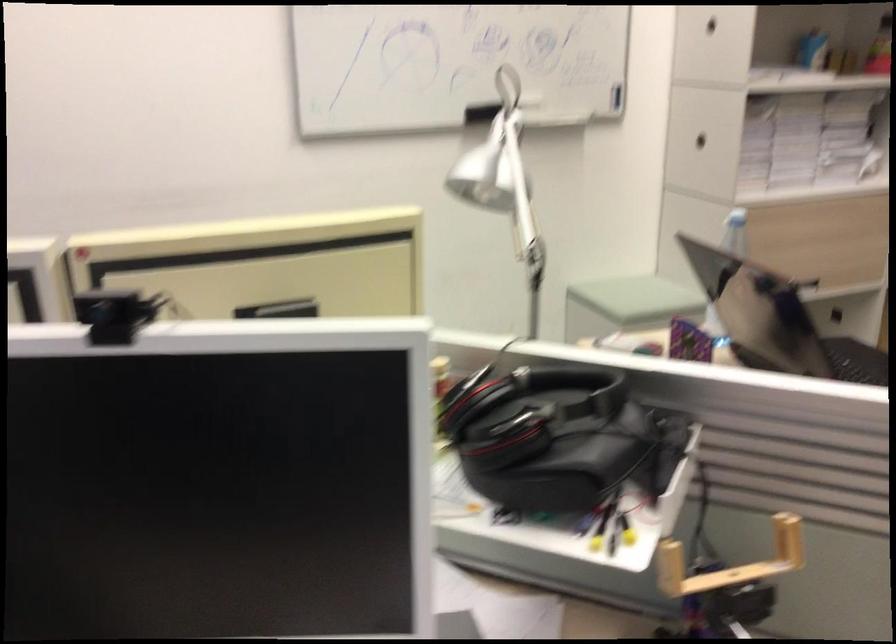
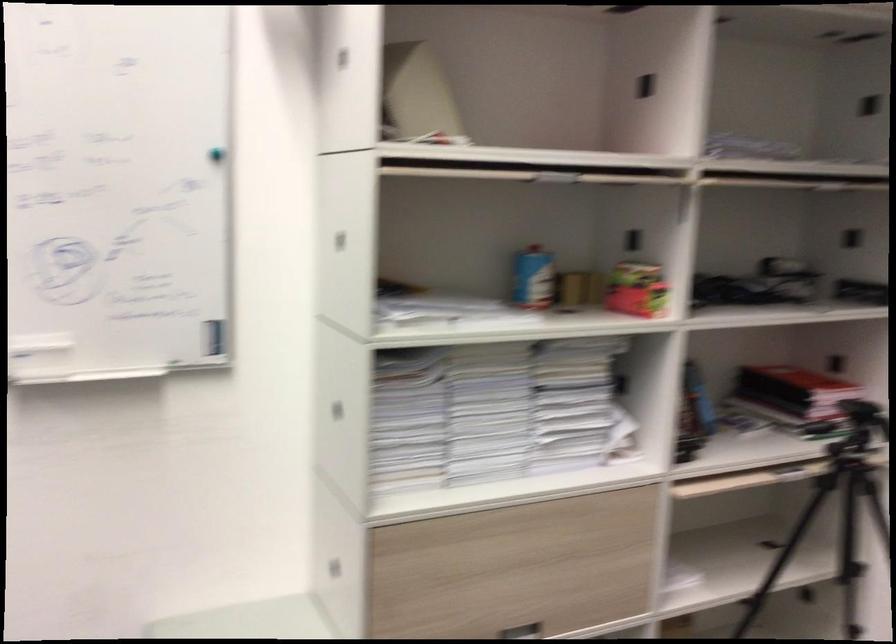
Where in the second image is the point corresponding to (810,283) from the first image?

(522, 630)